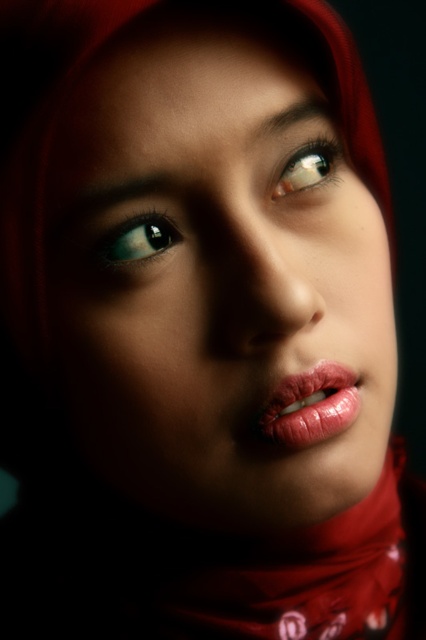
Which of these two, matte red hijab at center or shiny pink lips at center, stands shorter?

shiny pink lips at center

How distant is matte red hijab at center from shiny pink lips at center?

matte red hijab at center is 2.66 inches from shiny pink lips at center.

Identify the location of matte red hijab at center. (218, 289).

Which is more to the left, shiny pink lips at center or shiny brown eye at upper center?

shiny pink lips at center is more to the left.

Is shiny pink lips at center wider than shiny brown eye at upper center?

Yes.

At what (x,y) coordinates should I click in order to perform the action: click on shiny pink lips at center. Please return your answer as a coordinate pair (x, y). Image resolution: width=426 pixels, height=640 pixels. Looking at the image, I should click on (310, 406).

I want to click on shiny pink lips at center, so point(310,406).

Does matte blue eye at upper left appear over shiny brown eye at upper center?

Actually, matte blue eye at upper left is below shiny brown eye at upper center.

Does matte blue eye at upper left have a greater height compared to shiny brown eye at upper center?

No.

Who is more distant from viewer, (147, 228) or (310, 148)?

Positioned behind is point (310, 148).

Identify the location of matte blue eye at upper left. This screenshot has width=426, height=640. (135, 241).